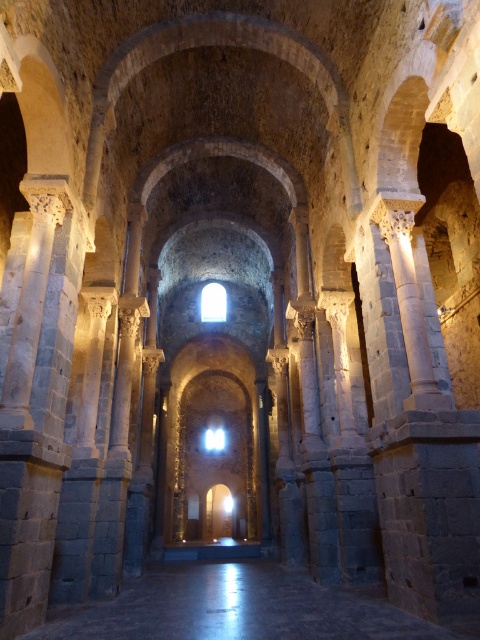
You are an architect visiting this historic stone structure. You notice the dark stone floor at center and the white glossy light at center. Which one do you think occupies more space in the image?

The dark stone floor at center is larger in size than the white glossy light at center, so it occupies more space in the image.

You are standing at the entrance of the historic stone structure and want to walk towards the white glossy light at center. Which direction should you move relative to the dark stone floor at center?

You should move towards the dark stone floor at center because it is in front of the white glossy light at center, meaning the light is behind the floor from your current position at the entrance.

You are standing at the entrance of the historic stone structure and want to walk to the dark stone floor at center. According to the coordinates provided, what are the coordinates of the point you need to move towards?

The coordinates of the dark stone floor at center are at point (240, 609).